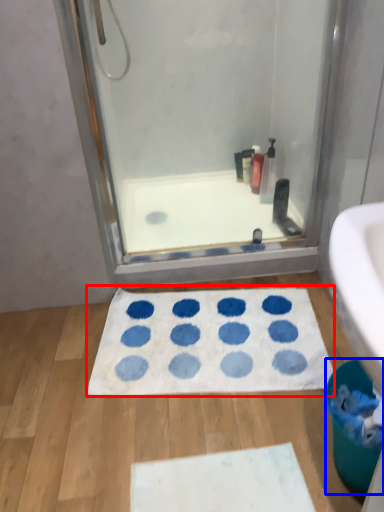
Question: Which object appears closest to the camera in this image, bath mat (highlighted by a red box) or toilet bowl (highlighted by a blue box)?

Choices:
 (A) bath mat
 (B) toilet bowl

Answer: (B)